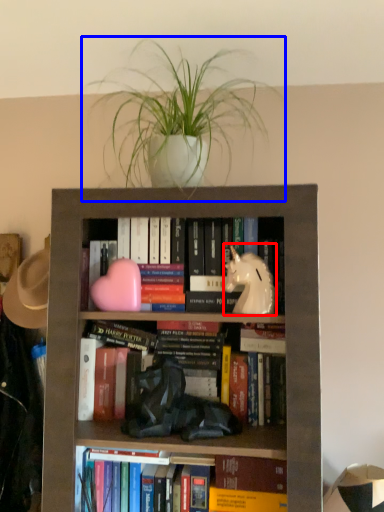
Question: Which point is further to the camera, animal (highlighted by a red box) or houseplant (highlighted by a blue box)?

Choices:
 (A) animal
 (B) houseplant

Answer: (A)